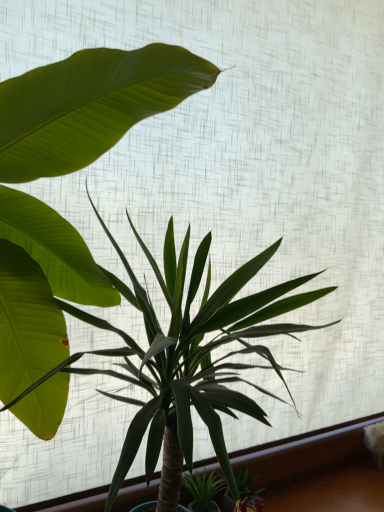
Question: Is green leafy plant at center, which is counted as the second houseplant, starting from the left, surrounded by green leafy plant at center, which appears as the first houseplant when viewed from the left?

Choices:
 (A) no
 (B) yes

Answer: (B)

Question: Can you confirm if green leafy plant at center, which appears as the first houseplant when viewed from the left, is wider than green leafy plant at center, the 1th houseplant from the right?

Choices:
 (A) yes
 (B) no

Answer: (B)

Question: Is green leafy plant at center, which appears as the first houseplant when viewed from the left, not within green leafy plant at center, the 1th houseplant from the right?

Choices:
 (A) no
 (B) yes

Answer: (A)

Question: From a real-world perspective, is green leafy plant at center, which is counted as the second houseplant, starting from the right, on green leafy plant at center, the 1th houseplant from the right?

Choices:
 (A) no
 (B) yes

Answer: (B)

Question: Does green leafy plant at center, which appears as the first houseplant when viewed from the left, lie behind green leafy plant at center, which is counted as the second houseplant, starting from the left?

Choices:
 (A) yes
 (B) no

Answer: (A)

Question: Is green leafy plant at center, which is counted as the second houseplant, starting from the left, inside the boundaries of green leafy plant at center, which appears as the first houseplant when viewed from the left, or outside?

Choices:
 (A) inside
 (B) outside

Answer: (A)

Question: From a real-world perspective, is green leafy plant at center, the 1th houseplant from the right, positioned above or below green leafy plant at center, which is counted as the second houseplant, starting from the right?

Choices:
 (A) below
 (B) above

Answer: (A)

Question: Considering their positions, is green leafy plant at center, which is counted as the second houseplant, starting from the left, located in front of or behind green leafy plant at center, which is counted as the second houseplant, starting from the right?

Choices:
 (A) behind
 (B) front

Answer: (B)

Question: In the image, is green leafy plant at center, the 1th houseplant from the right, on the left side or the right side of green leafy plant at center, which appears as the first houseplant when viewed from the left?

Choices:
 (A) right
 (B) left

Answer: (A)

Question: From the image's perspective, relative to green leafy plant at lower center, is green leafy plant at center, which appears as the first houseplant when viewed from the left, above or below?

Choices:
 (A) below
 (B) above

Answer: (B)

Question: Is green leafy plant at center, which is counted as the second houseplant, starting from the right, spatially inside green leafy plant at lower center, or outside of it?

Choices:
 (A) outside
 (B) inside

Answer: (A)

Question: In the image, is green leafy plant at center, which appears as the first houseplant when viewed from the left, positioned in front of or behind green leafy plant at lower center?

Choices:
 (A) front
 (B) behind

Answer: (A)

Question: From their relative heights in the image, would you say green leafy plant at center, which is counted as the second houseplant, starting from the right, is taller or shorter than green leafy plant at lower center?

Choices:
 (A) tall
 (B) short

Answer: (A)

Question: From the image's perspective, is green leafy plant at center, the 1th houseplant from the right, located above or below green leafy plant at lower center?

Choices:
 (A) below
 (B) above

Answer: (B)

Question: Looking at their shapes, would you say green leafy plant at center, which is counted as the second houseplant, starting from the left, is wider or thinner than green leafy plant at lower center?

Choices:
 (A) wide
 (B) thin

Answer: (A)